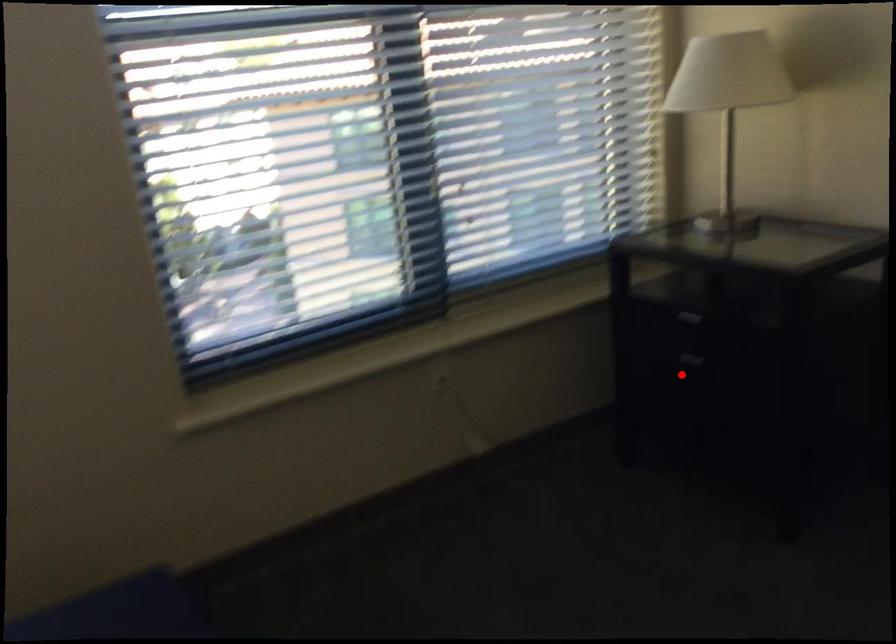
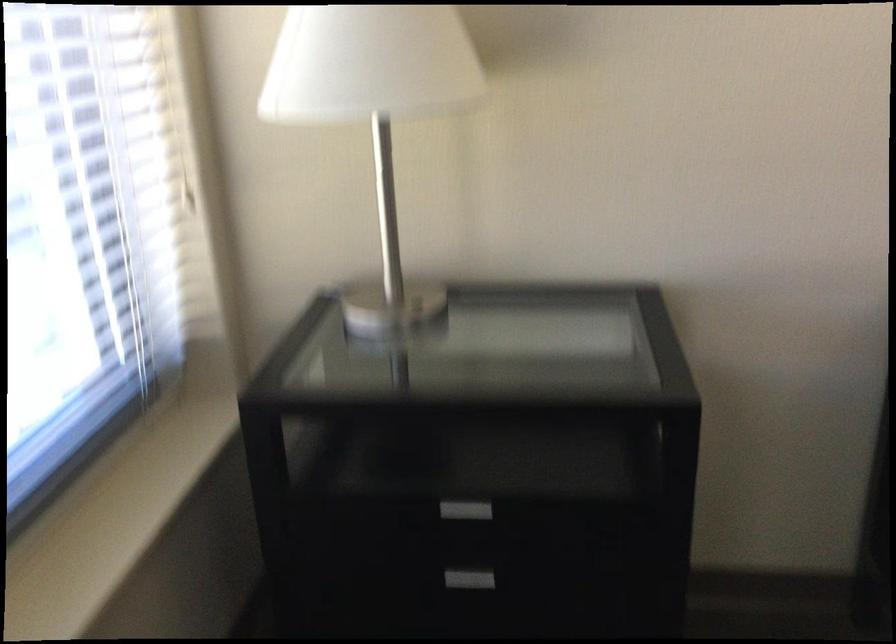
Question: I am providing you with two images of the same scene from different viewpoints. In image1, a red point is highlighted. Considering the same 3D point in image2, which of the following is correct?

Choices:
 (A) It is closer
 (B) It is farther

Answer: (A)